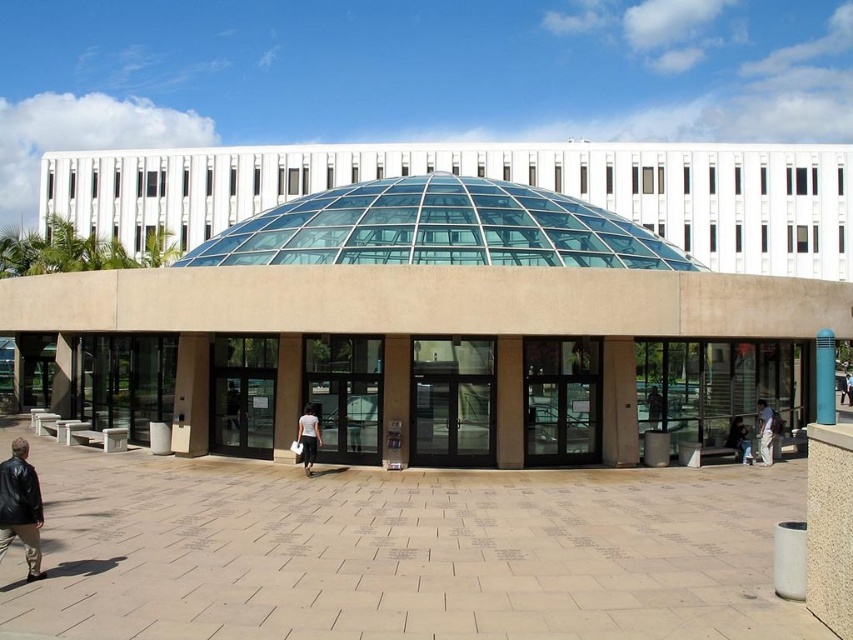
Question: Which point is farther to the camera?

Choices:
 (A) (733, 426)
 (B) (469, 445)
 (C) (312, 460)
 (D) (851, 381)

Answer: (D)

Question: Is transparent glass dome at center thinner than light blue jeans at lower right?

Choices:
 (A) yes
 (B) no

Answer: (B)

Question: Which object is positioned farthest from the white fabric shirt at center?

Choices:
 (A) white matte shirt at center
 (B) transparent glass dome at center

Answer: (A)

Question: Can you confirm if transparent glass dome at center is thinner than light blue jeans at lower right?

Choices:
 (A) no
 (B) yes

Answer: (A)

Question: Is clear glass door at center thinner than blue glossy pillar at center?

Choices:
 (A) yes
 (B) no

Answer: (A)

Question: Which of the following is the farthest from the observer?

Choices:
 (A) white matte shirt at center
 (B) clear glass door at center

Answer: (B)